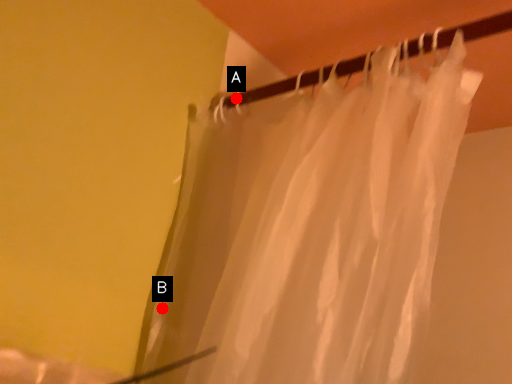
Question: Two points are circled on the image, labeled by A and B beside each circle. Which point appears farthest from the camera in this image?

Choices:
 (A) A is further
 (B) B is further

Answer: (A)